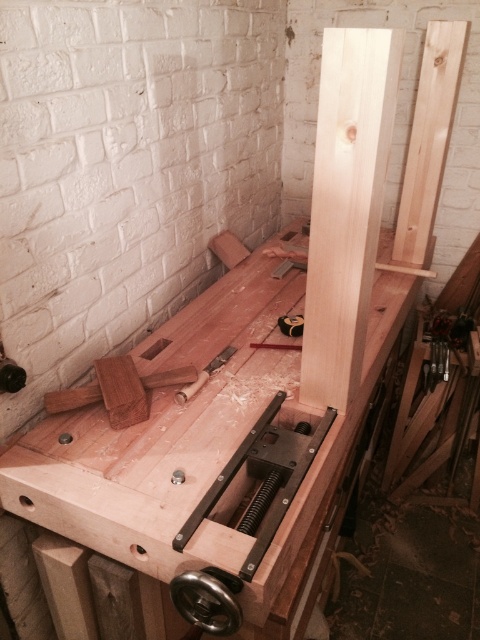
Question: Which object is the closest to the natural wood beam at center?

Choices:
 (A) natural wood workbench at center
 (B) wooden handle at center

Answer: (A)

Question: Considering the real-world distances, which object is closest to the wooden handle at center?

Choices:
 (A) natural wood workbench at center
 (B) natural wood beam at center

Answer: (A)

Question: In this image, where is natural wood beam at center located relative to wooden handle at center?

Choices:
 (A) right
 (B) left

Answer: (A)

Question: From the image, what is the correct spatial relationship of natural wood workbench at center in relation to natural wood beam at center?

Choices:
 (A) right
 (B) left

Answer: (B)

Question: Estimate the real-world distances between objects in this image. Which object is closer to the natural wood workbench at center?

Choices:
 (A) natural wood beam at center
 (B) wooden handle at center

Answer: (B)

Question: Does natural wood workbench at center have a smaller size compared to wooden handle at center?

Choices:
 (A) no
 (B) yes

Answer: (A)